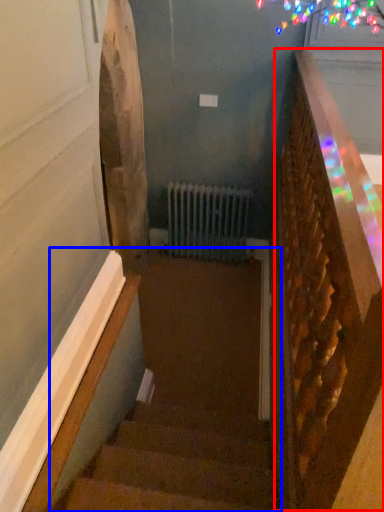
Question: Which object is further to the camera taking this photo, rail (highlighted by a red box) or stairs (highlighted by a blue box)?

Choices:
 (A) rail
 (B) stairs

Answer: (B)